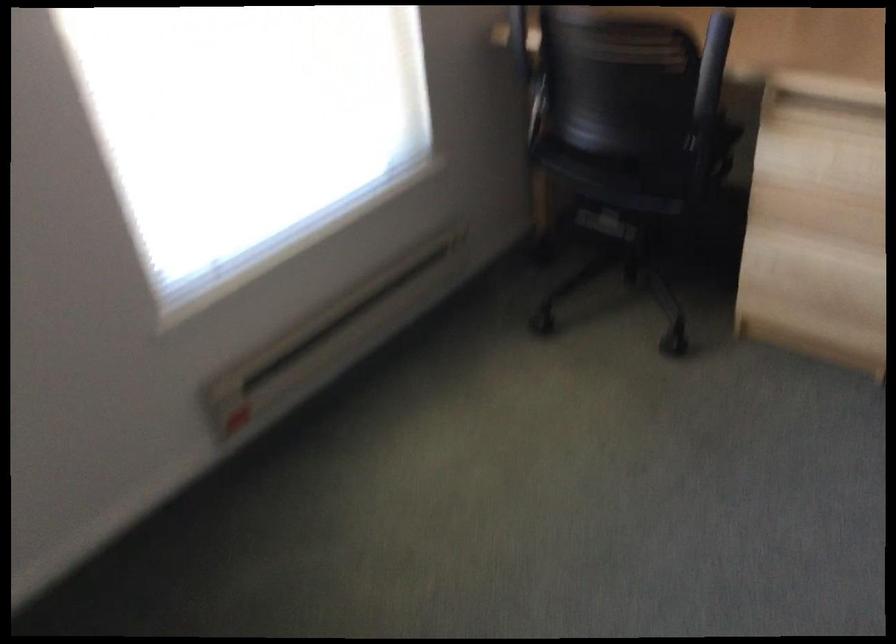
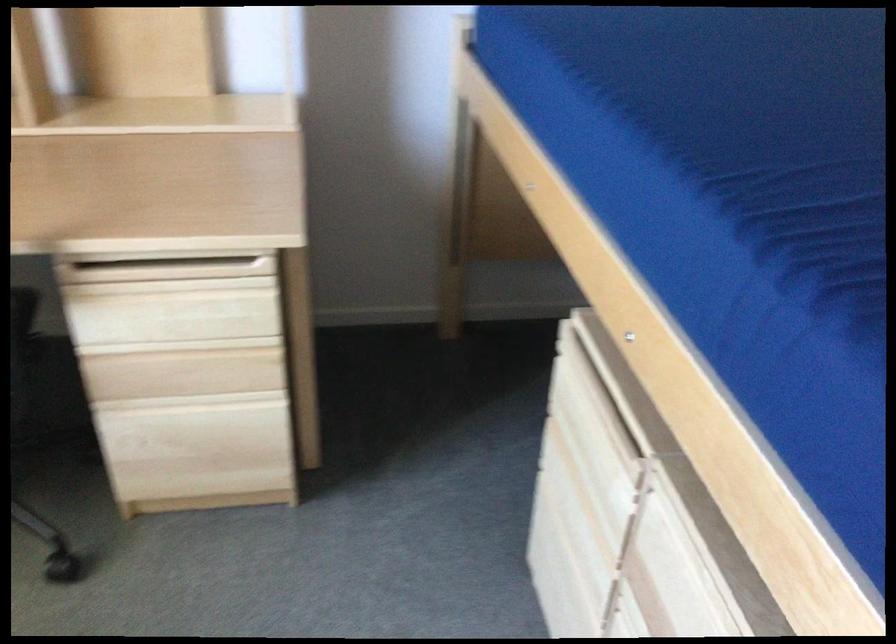
Question: The images are taken continuously from a first-person perspective. In which direction is your viewpoint rotating?

Choices:
 (A) Left
 (B) Right
 (C) Up
 (D) Down

Answer: (B)